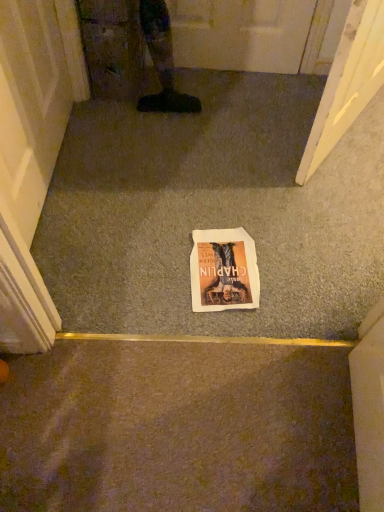
The height and width of the screenshot is (512, 384). What are the coordinates of `blank area beneath white paper comic book at center (from a real-world perspective)` in the screenshot? It's located at click(215, 265).